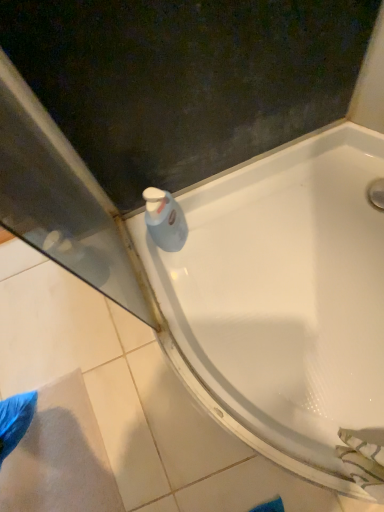
Image resolution: width=384 pixels, height=512 pixels. In order to click on vacant space situated above white glossy bathtub at upper center (from a real-world perspective) in this screenshot , I will do `click(101, 393)`.